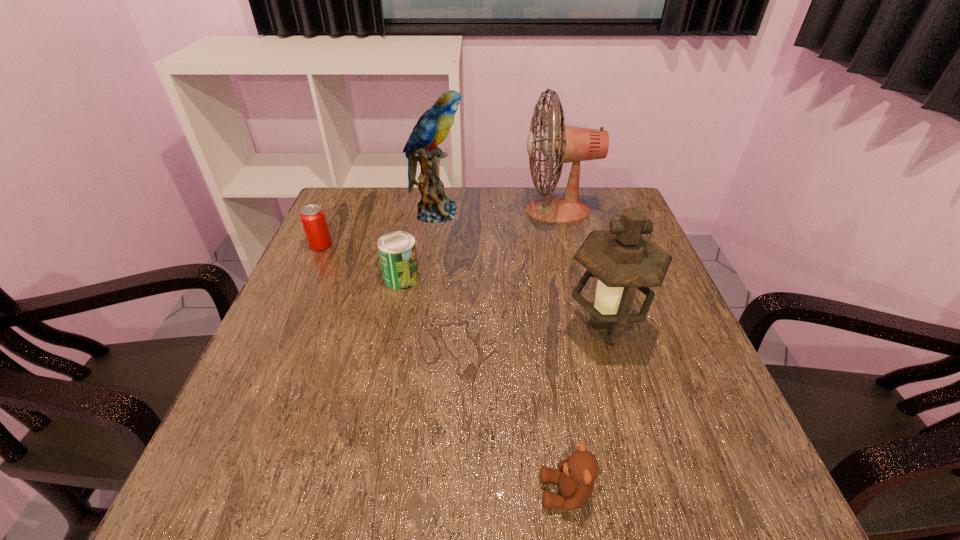
At what (x,y) coordinates should I click in order to perform the action: click on parrot. Please return your answer as a coordinate pair (x, y). This screenshot has width=960, height=540. Looking at the image, I should click on (432, 128).

The image size is (960, 540). I want to click on fan, so click(569, 144).

Find the location of a particular element. Image resolution: width=960 pixels, height=540 pixels. the third tallest object is located at coordinates (623, 260).

You are a GUI agent. You are given a task and a screenshot of the screen. Output one action in this format:
    pyautogui.click(x=<x>, y=<y>)
    Task: Click on the oil lamp
    The height and width of the screenshot is (540, 960).
    Given the screenshot: What is the action you would take?
    pyautogui.click(x=623, y=260)

This screenshot has height=540, width=960. I want to click on the left can, so click(313, 219).

The width and height of the screenshot is (960, 540). Find the location of `the farther can`. the farther can is located at coordinates (313, 219).

Locate an element on the screen. The height and width of the screenshot is (540, 960). the fourth farthest object is located at coordinates (397, 250).

Identify the location of the nearer can. (397, 250).

Identify the location of the nearest object. This screenshot has height=540, width=960. (576, 475).

Where is `vacant area located on the face of the parrot`? This screenshot has width=960, height=540. vacant area located on the face of the parrot is located at coordinates click(521, 212).